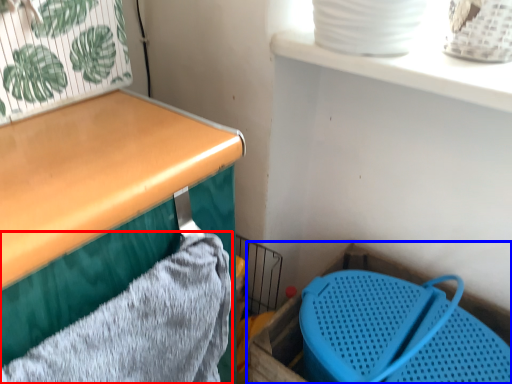
Question: Among these objects, which one is farthest to the camera, bath towel (highlighted by a red box) or storage box (highlighted by a blue box)?

Choices:
 (A) bath towel
 (B) storage box

Answer: (B)